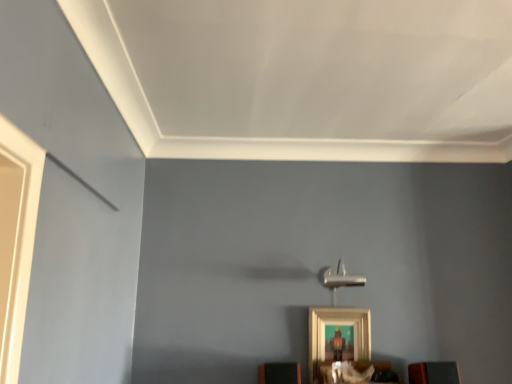
Question: From a real-world perspective, is gold metallic picture frame at lower center physically located above or below orange matte speaker at lower center, acting as the 1th furniture starting from the left?

Choices:
 (A) above
 (B) below

Answer: (A)

Question: In the image, is gold metallic picture frame at lower center positioned in front of or behind orange matte speaker at lower center, acting as the 1th furniture starting from the left?

Choices:
 (A) behind
 (B) front

Answer: (A)

Question: Which is nearer to the orange matte speaker at lower center, acting as the third furniture starting from the right?

Choices:
 (A) gold metallic picture frame at lower center
 (B) matte black speaker at lower right, which appears as the 3th furniture when viewed from the left
 (C) wooden shelf at lower center, the second furniture from the left

Answer: (C)

Question: Based on their relative distances, which object is nearer to the matte black speaker at lower right, which appears as the 3th furniture when viewed from the left?

Choices:
 (A) orange matte speaker at lower center, acting as the 1th furniture starting from the left
 (B) wooden shelf at lower center, which ranks as the 2th furniture in right-to-left order
 (C) gold metallic picture frame at lower center

Answer: (B)